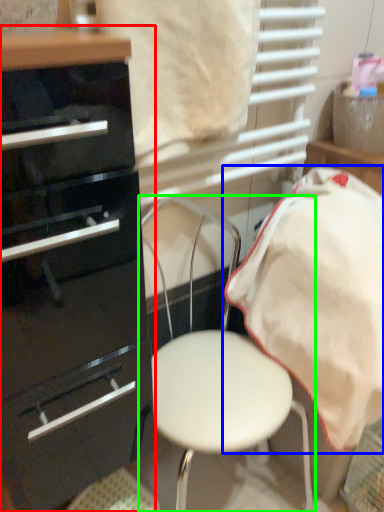
Question: Which object is the closest to the chest of drawers (highlighted by a red box)? Choose among these: bedding (highlighted by a blue box) or chair (highlighted by a green box).

Choices:
 (A) bedding
 (B) chair

Answer: (B)